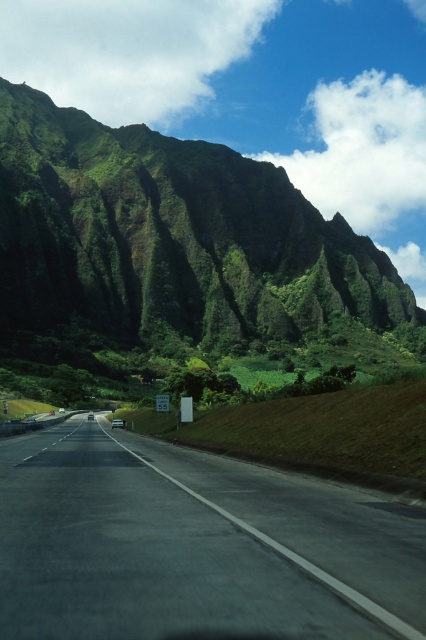
Does green grassy mountain at upper left have a smaller size compared to black asphalt highway at center?

No, green grassy mountain at upper left is not smaller than black asphalt highway at center.

Is green grassy mountain at upper left to the left of black asphalt highway at center from the viewer's perspective?

No, green grassy mountain at upper left is not to the left of black asphalt highway at center.

The image size is (426, 640). What are the coordinates of `green grassy mountain at upper left` in the screenshot? It's located at (166, 246).

This screenshot has width=426, height=640. What are the coordinates of `green grassy mountain at upper left` in the screenshot? It's located at (166, 246).